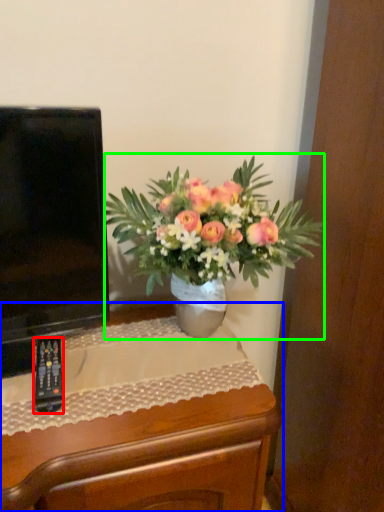
Question: Considering the real-world distances, which object is farthest from remote control (highlighted by a red box)? desk (highlighted by a blue box) or houseplant (highlighted by a green box)?

Choices:
 (A) desk
 (B) houseplant

Answer: (B)